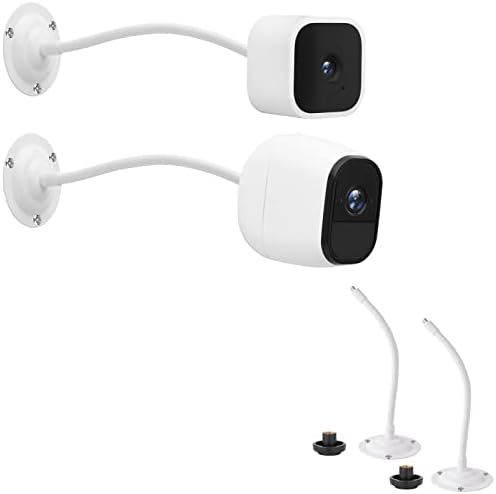
You are a GUI agent. You are given a task and a screenshot of the screen. Output one action in this format:
    pyautogui.click(x=<x>, y=<y>)
    Task: Click on the screws
    
    Given the screenshot: What is the action you would take?
    pyautogui.click(x=53, y=23), pyautogui.click(x=8, y=29), pyautogui.click(x=37, y=89), pyautogui.click(x=10, y=162), pyautogui.click(x=38, y=220), pyautogui.click(x=51, y=158)